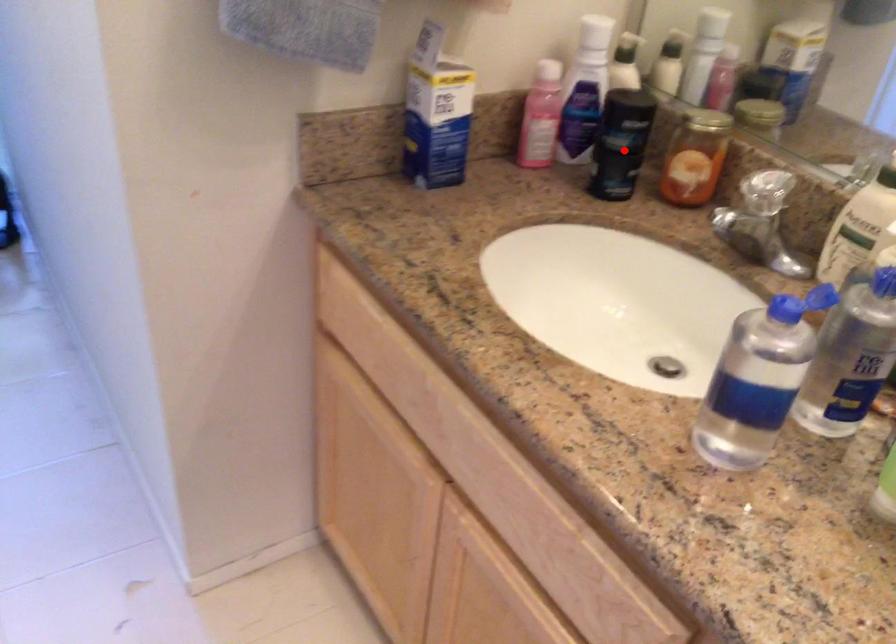
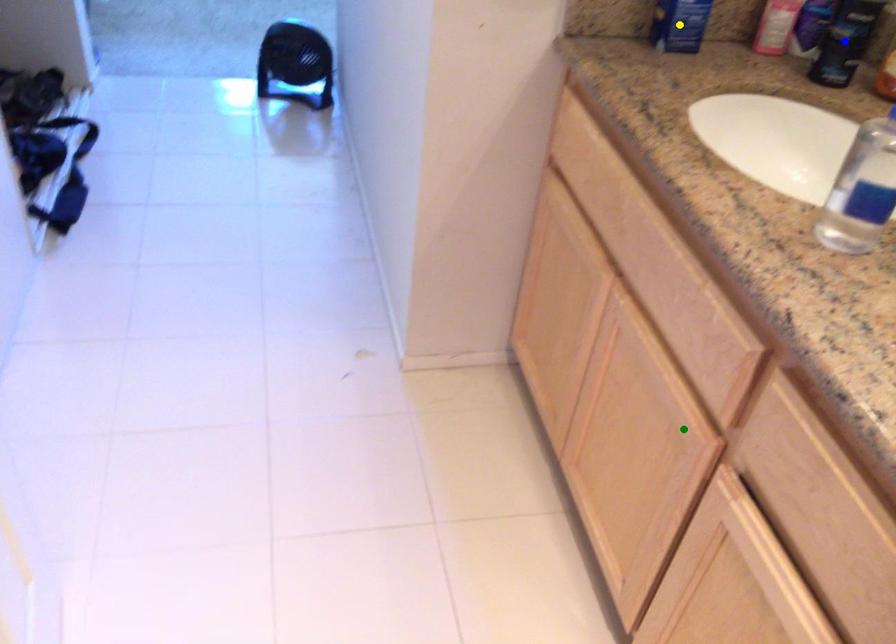
Question: I am providing you with two images of the same scene from different viewpoints. A red point is marked on the first image. You are given multiple points on the second image. Can you choose the point in image 2 that corresponds to the point in image 1?

Choices:
 (A) yellow point
 (B) green point
 (C) blue point

Answer: (C)